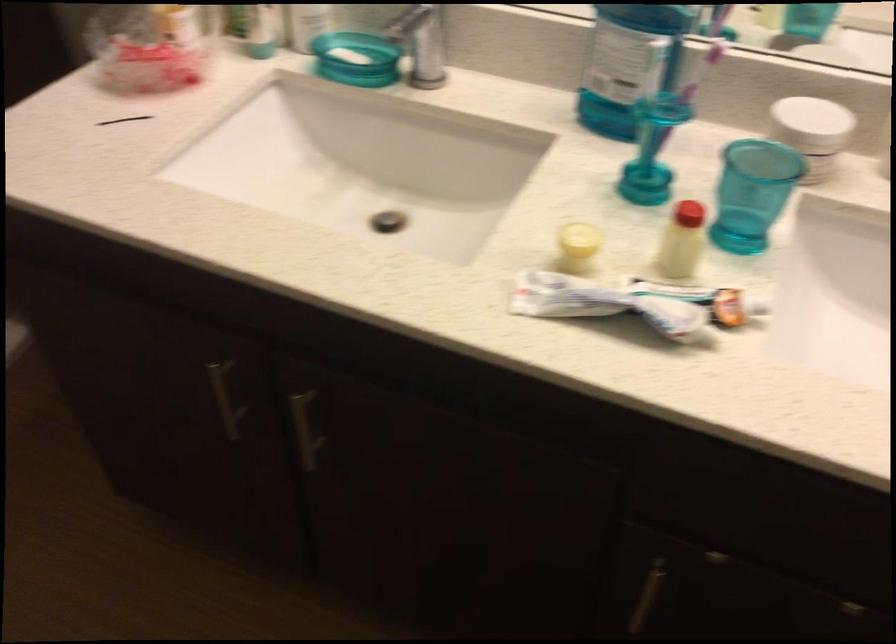
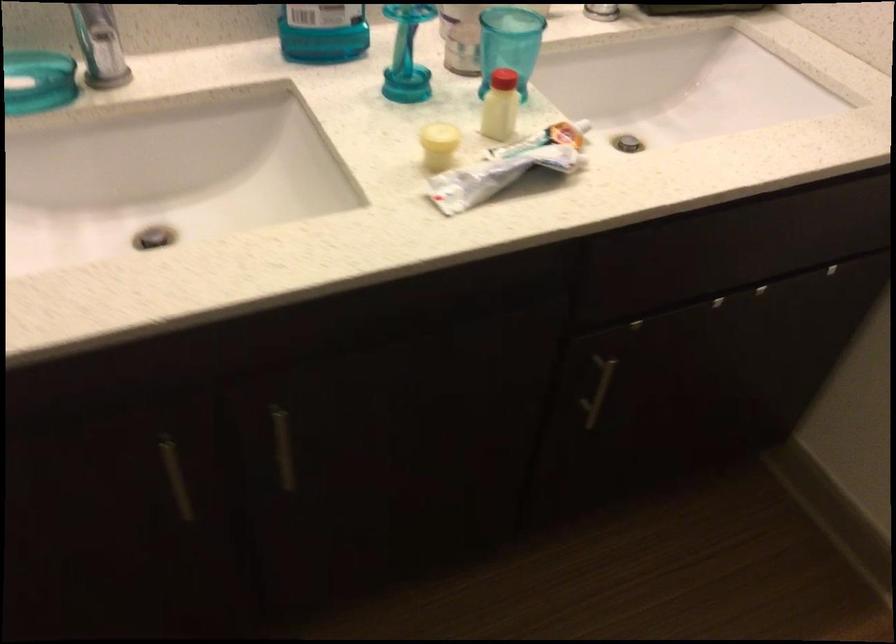
Question: I am providing you with two images of the same scene from different viewpoints. Which of the following objects are not visible in image2?

Choices:
 (A) blue mouthwash bottle
 (B) blue toothbrush holder
 (C) toothpaste tube
 (D) none of these

Answer: (D)